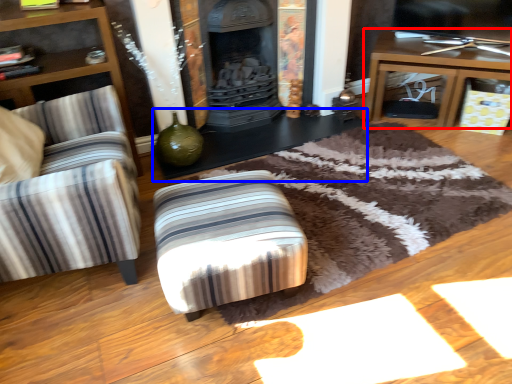
Question: Which point is closer to the camera, table (highlighted by a red box) or table (highlighted by a blue box)?

Choices:
 (A) table
 (B) table

Answer: (B)